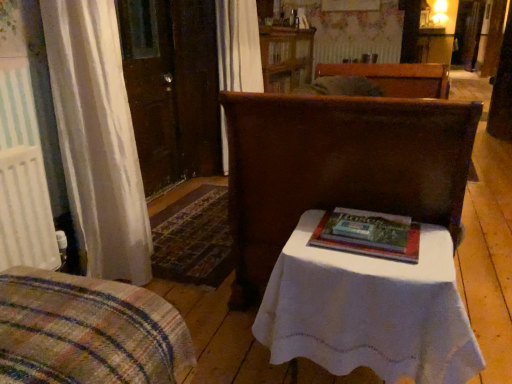
Question: Considering the relative positions of plaid fabric bedspread at lower left, marked as the 2th furniture in a right-to-left arrangement, and matte brown chair at center, the 1th furniture in the right-to-left sequence, in the image provided, is plaid fabric bedspread at lower left, marked as the 2th furniture in a right-to-left arrangement, in front of matte brown chair at center, the 1th furniture in the right-to-left sequence,?

Choices:
 (A) no
 (B) yes

Answer: (B)

Question: Considering the relative sizes of plaid fabric bedspread at lower left, marked as the 2th furniture in a right-to-left arrangement, and matte brown chair at center, the second furniture viewed from the front, in the image provided, is plaid fabric bedspread at lower left, marked as the 2th furniture in a right-to-left arrangement, wider than matte brown chair at center, the second furniture viewed from the front,?

Choices:
 (A) yes
 (B) no

Answer: (B)

Question: Is plaid fabric bedspread at lower left, which appears as the 1th furniture when viewed from the front, far away from matte brown chair at center, the 1th furniture in the right-to-left sequence?

Choices:
 (A) no
 (B) yes

Answer: (A)

Question: From the image's perspective, is plaid fabric bedspread at lower left, which is counted as the 1th furniture, starting from the left, beneath matte brown chair at center, the second furniture viewed from the front?

Choices:
 (A) no
 (B) yes

Answer: (B)

Question: From a real-world perspective, is plaid fabric bedspread at lower left, placed as the second furniture when sorted from back to front, positioned over matte brown chair at center, the 1th furniture in the right-to-left sequence, based on gravity?

Choices:
 (A) yes
 (B) no

Answer: (B)

Question: In terms of height, does matte brown chair at center, the second furniture viewed from the front, look taller or shorter compared to wooden cabinet at upper center?

Choices:
 (A) tall
 (B) short

Answer: (A)

Question: Considering the positions of matte brown chair at center, the 2th furniture viewed from the left, and wooden cabinet at upper center in the image, is matte brown chair at center, the 2th furniture viewed from the left, wider or thinner than wooden cabinet at upper center?

Choices:
 (A) thin
 (B) wide

Answer: (B)

Question: In the image, is matte brown chair at center, the 2th furniture viewed from the left, on the left side or the right side of wooden cabinet at upper center?

Choices:
 (A) left
 (B) right

Answer: (B)

Question: Looking at the image, does matte brown chair at center, which is the 1th furniture from back to front, seem bigger or smaller compared to wooden cabinet at upper center?

Choices:
 (A) small
 (B) big

Answer: (B)

Question: Relative to wooden cabinet at upper center, is hardcover book at center in front or behind?

Choices:
 (A) front
 (B) behind

Answer: (A)

Question: In terms of height, does hardcover book at center look taller or shorter compared to wooden cabinet at upper center?

Choices:
 (A) short
 (B) tall

Answer: (A)

Question: Is point (350, 246) positioned closer to the camera than point (304, 74)?

Choices:
 (A) closer
 (B) farther

Answer: (A)

Question: From a real-world perspective, is hardcover book at center positioned above or below wooden cabinet at upper center?

Choices:
 (A) below
 (B) above

Answer: (A)

Question: Considering the positions of point (400, 253) and point (349, 311), is point (400, 253) closer or farther from the camera than point (349, 311)?

Choices:
 (A) closer
 (B) farther

Answer: (B)

Question: Is hardcover book at center inside the boundaries of white cloth-covered table at center, or outside?

Choices:
 (A) outside
 (B) inside

Answer: (A)